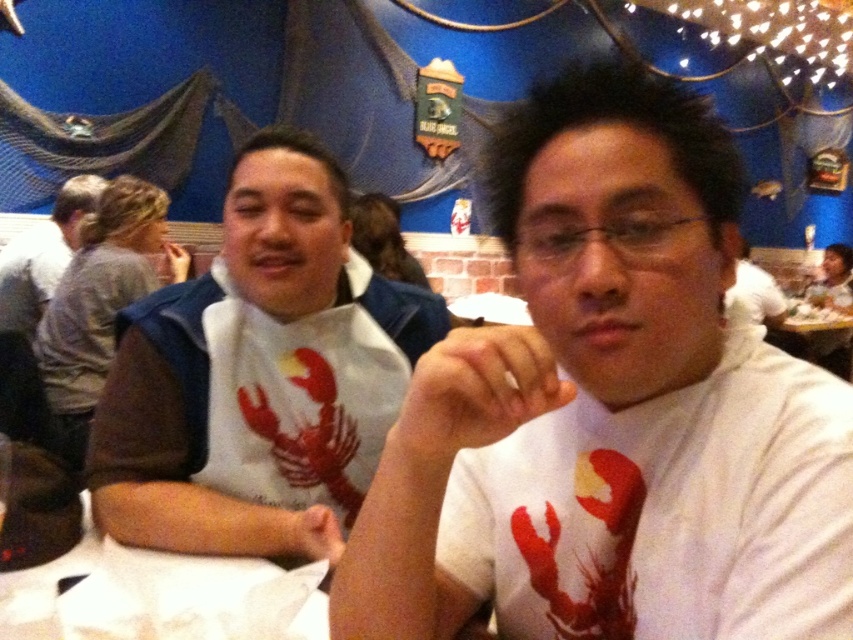
Question: Which point appears farthest from the camera in this image?

Choices:
 (A) (689, 410)
 (B) (45, 256)

Answer: (B)

Question: Is white matte t-shirt at center closer to camera compared to gray fabric shirt at left?

Choices:
 (A) yes
 (B) no

Answer: (A)

Question: Is white matte t-shirt at center to the right of white fabric shirt at left from the viewer's perspective?

Choices:
 (A) no
 (B) yes

Answer: (B)

Question: Which object is closer to the camera taking this photo?

Choices:
 (A) gray fabric shirt at left
 (B) white matte t-shirt at center

Answer: (B)

Question: Is white matte t-shirt at center thinner than gray fabric shirt at left?

Choices:
 (A) yes
 (B) no

Answer: (A)

Question: Which is nearer to the white fabric shirt at left?

Choices:
 (A) gray fabric shirt at left
 (B) white matte t-shirt at center

Answer: (B)